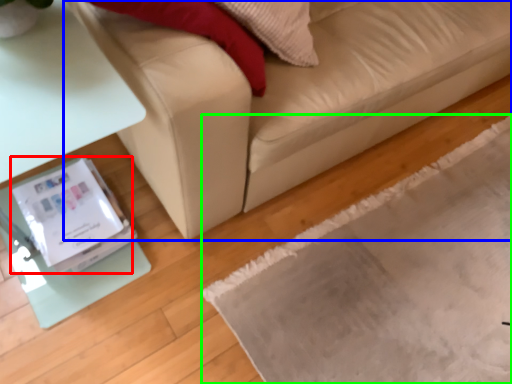
Question: Estimate the real-world distances between objects in this image. Which object is closer to Wii (highlighted by a red box), studio couch (highlighted by a blue box) or mat (highlighted by a green box)?

Choices:
 (A) studio couch
 (B) mat

Answer: (A)